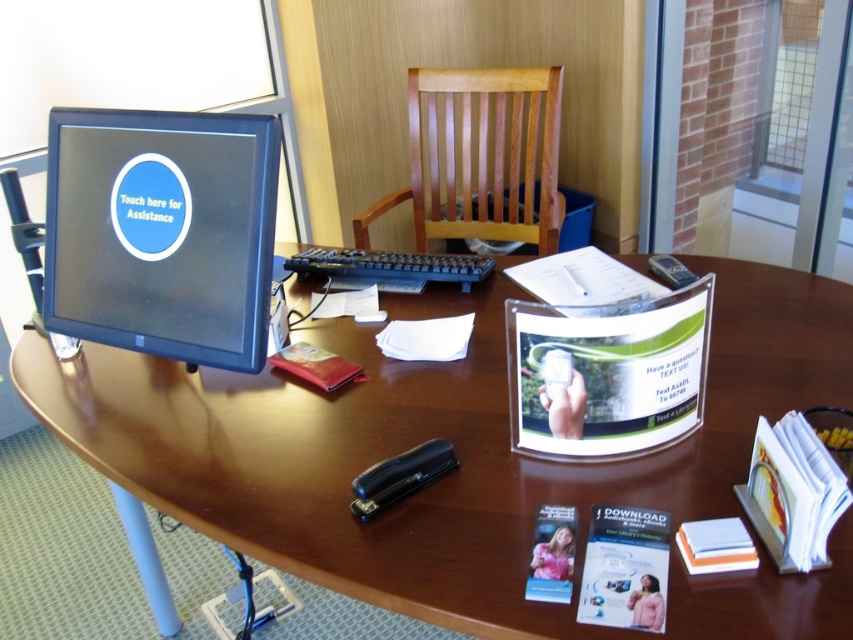
Who is more forward, (x=316, y=461) or (x=120, y=328)?

Positioned in front is point (x=316, y=461).

Is wooden computer desk at center taller than matte black monitor at left?

Yes, wooden computer desk at center is taller than matte black monitor at left.

Between point (403, 296) and point (149, 180), which one is positioned behind?

Positioned behind is point (403, 296).

Image resolution: width=853 pixels, height=640 pixels. What are the coordinates of `wooden computer desk at center` in the screenshot? It's located at (428, 438).

Is wooden computer desk at center wider than wooden slats chair at center?

Yes.

Which is in front, point (338, 404) or point (439, 84)?

Point (338, 404) is more forward.

The image size is (853, 640). What do you see at coordinates (428, 438) in the screenshot?
I see `wooden computer desk at center` at bounding box center [428, 438].

This screenshot has width=853, height=640. In order to click on wooden computer desk at center in this screenshot , I will do `click(428, 438)`.

Who is more forward, (148, 236) or (474, 209)?

Point (148, 236) is in front.

Who is more distant from viewer, (x=112, y=211) or (x=418, y=80)?

Point (x=418, y=80)

Where is `matte black monitor at left`? matte black monitor at left is located at coordinates (161, 232).